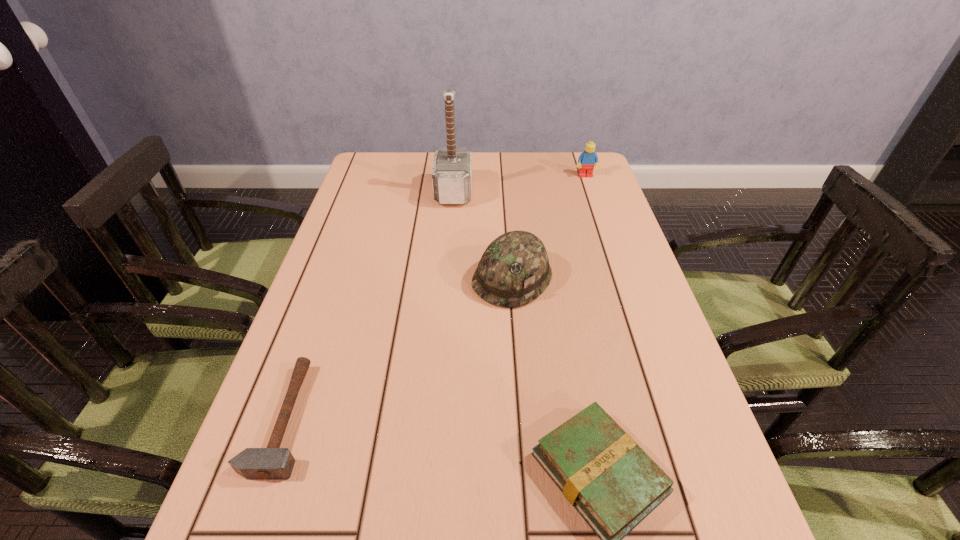
Where is `hammer present at the far edge`? The image size is (960, 540). hammer present at the far edge is located at coordinates (452, 168).

Identify the location of Lego at the far edge. [x=588, y=158].

Image resolution: width=960 pixels, height=540 pixels. In order to click on object at the left edge in this screenshot , I will do `click(272, 463)`.

Find the location of `object present at the right edge`. object present at the right edge is located at coordinates (588, 158).

Find the location of a particular element. The height and width of the screenshot is (540, 960). object that is at the far right corner is located at coordinates (588, 158).

The height and width of the screenshot is (540, 960). Find the location of `vacant space at the far edge`. vacant space at the far edge is located at coordinates (515, 171).

Identify the location of blank space at the left edge of the desktop. point(338,454).

Identify the location of vacant space at the right edge of the desktop. (587, 234).

In the image, there is a desktop. At what (x,y) coordinates should I click in order to perform the action: click on free space at the far left corner. Please return your answer as a coordinate pair (x, y). The height and width of the screenshot is (540, 960). Looking at the image, I should click on (401, 174).

In the image, there is a desktop. What are the coordinates of `vacant space at the far right corner` in the screenshot? It's located at (552, 159).